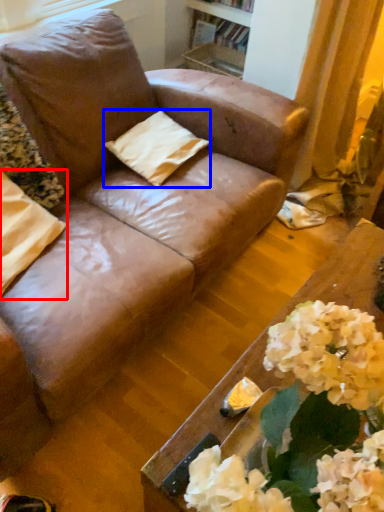
Question: Among these objects, which one is nearest to the camera, pillow (highlighted by a red box) or pillow (highlighted by a blue box)?

Choices:
 (A) pillow
 (B) pillow

Answer: (A)